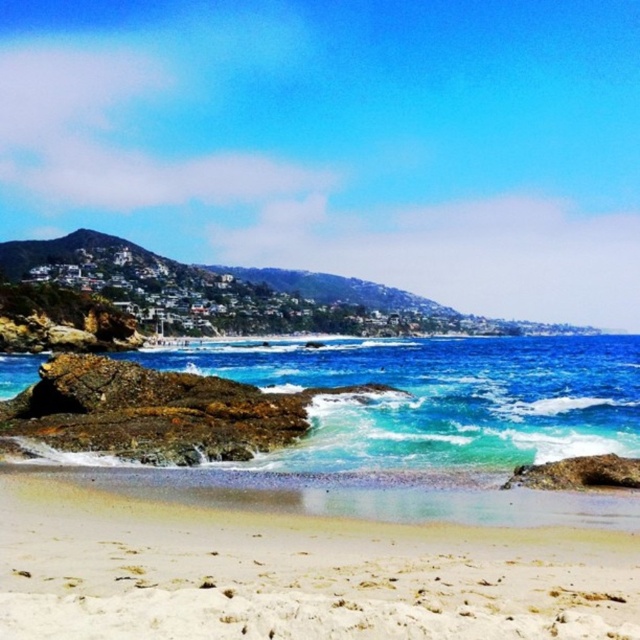
Which is below, smooth beige sand at lower center or blue translucent water at center?

smooth beige sand at lower center

Is smooth beige sand at lower center below blue translucent water at center?

Correct, smooth beige sand at lower center is located below blue translucent water at center.

Who is more distant from viewer, (461, 525) or (524, 426)?

Point (524, 426)

In order to click on smooth beige sand at lower center in this screenshot , I will do `click(296, 573)`.